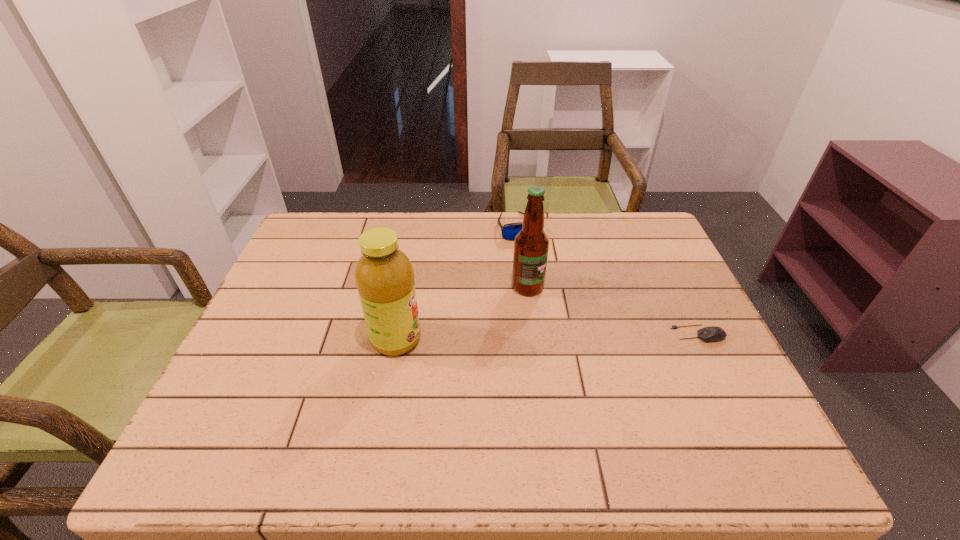
The height and width of the screenshot is (540, 960). I want to click on vacant area at the far right corner, so click(x=660, y=235).

At what (x,y) coordinates should I click in order to perform the action: click on free space between the mouse and the fruit juice. Please return your answer as a coordinate pair (x, y). The height and width of the screenshot is (540, 960). Looking at the image, I should click on click(547, 336).

The width and height of the screenshot is (960, 540). Identify the location of empty space that is in between the leftmost object and the third tallest object. (457, 283).

Find the location of a particular element. The height and width of the screenshot is (540, 960). vacant space that is in between the farthest object and the mouse is located at coordinates (608, 280).

At what (x,y) coordinates should I click in order to perform the action: click on free space between the fruit juice and the mouse. Please return your answer as a coordinate pair (x, y). Looking at the image, I should click on (547, 336).

You are a GUI agent. You are given a task and a screenshot of the screen. Output one action in this format:
    pyautogui.click(x=<x>, y=<y>)
    Task: Click on the vacant area that lies between the mouse and the fruit juice
    
    Given the screenshot: What is the action you would take?
    pyautogui.click(x=547, y=336)

At what (x,y) coordinates should I click in order to perform the action: click on free space between the leftmost object and the beer bottle. Please return your answer as a coordinate pair (x, y). The height and width of the screenshot is (540, 960). Looking at the image, I should click on (462, 313).

You are a GUI agent. You are given a task and a screenshot of the screen. Output one action in this format:
    pyautogui.click(x=<x>, y=<y>)
    Task: Click on the empty space that is in between the shortest object and the sunglasses
    The image size is (960, 540).
    Given the screenshot: What is the action you would take?
    pyautogui.click(x=608, y=280)

You are a GUI agent. You are given a task and a screenshot of the screen. Output one action in this format:
    pyautogui.click(x=<x>, y=<y>)
    Task: Click on the empty space that is in between the fruit juice and the second shortest object
    This screenshot has width=960, height=540.
    Given the screenshot: What is the action you would take?
    pyautogui.click(x=457, y=283)

Locate which object ranks second in proximity to the shortest object. Please provide its 2D coordinates. Your answer should be formatted as a tuple, i.e. [(x, y)], where the tuple contains the x and y coordinates of a point satisfying the conditions above.

[(509, 231)]